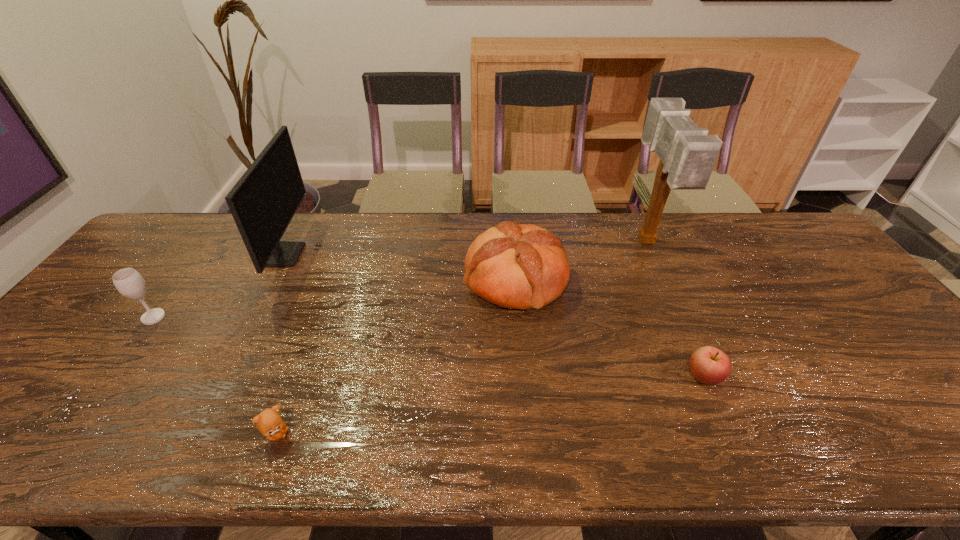
The height and width of the screenshot is (540, 960). In the image, there is a desktop. Find the location of `vacant space at the right edge`. vacant space at the right edge is located at coordinates (836, 282).

Where is `free space between the tallest object and the second nearest object`? free space between the tallest object and the second nearest object is located at coordinates (675, 309).

Identify the location of free area in between the bread and the fifth object from right to left. The image size is (960, 540). (400, 267).

You are a GUI agent. You are given a task and a screenshot of the screen. Output one action in this format:
    pyautogui.click(x=<x>, y=<y>)
    Task: Click on the unoccupied area between the bread and the fifth farthest object
    This screenshot has height=540, width=960.
    Given the screenshot: What is the action you would take?
    pyautogui.click(x=610, y=328)

Locate an element on the screen. Image resolution: width=960 pixels, height=540 pixels. empty space that is in between the apple and the computer monitor is located at coordinates (494, 315).

Identify the location of vacant space in between the tallest object and the leftmost object. (400, 280).

The image size is (960, 540). What are the coordinates of `free space between the mallet and the nearest object` in the screenshot? It's located at (462, 339).

Where is `empty location between the nearest object and the third object from right to left`? The width and height of the screenshot is (960, 540). empty location between the nearest object and the third object from right to left is located at coordinates (396, 357).

What are the coordinates of `free space between the bread and the mallet` in the screenshot? It's located at (581, 261).

Image resolution: width=960 pixels, height=540 pixels. What are the coordinates of `free area in between the third object from right to left and the nearest object` in the screenshot? It's located at (396, 357).